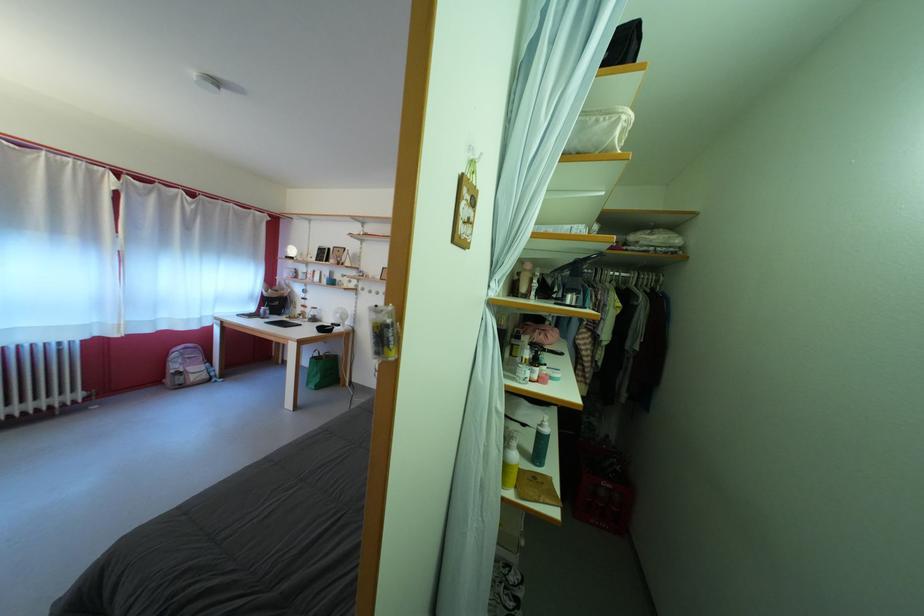
This screenshot has height=616, width=924. What do you see at coordinates (187, 367) in the screenshot?
I see `a pink backpack handle` at bounding box center [187, 367].